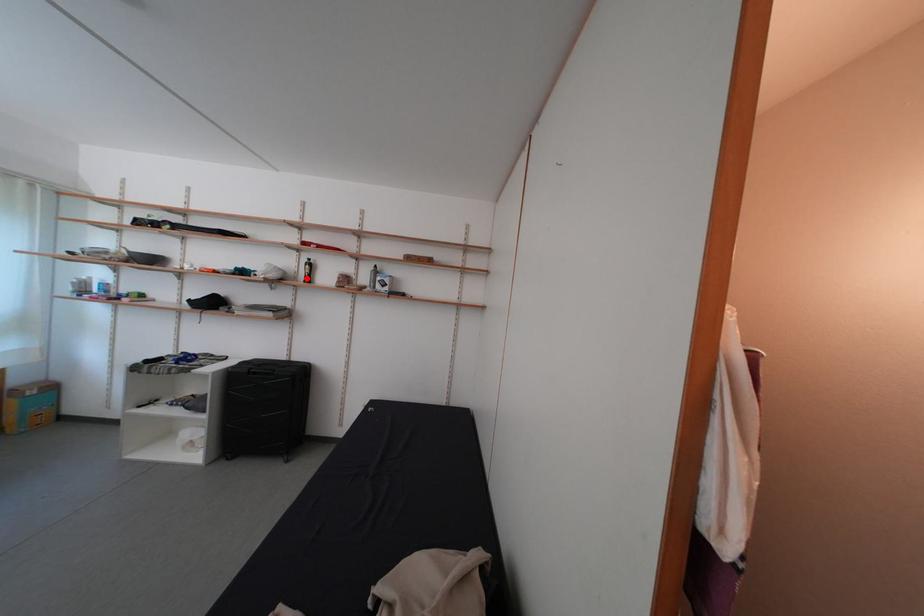
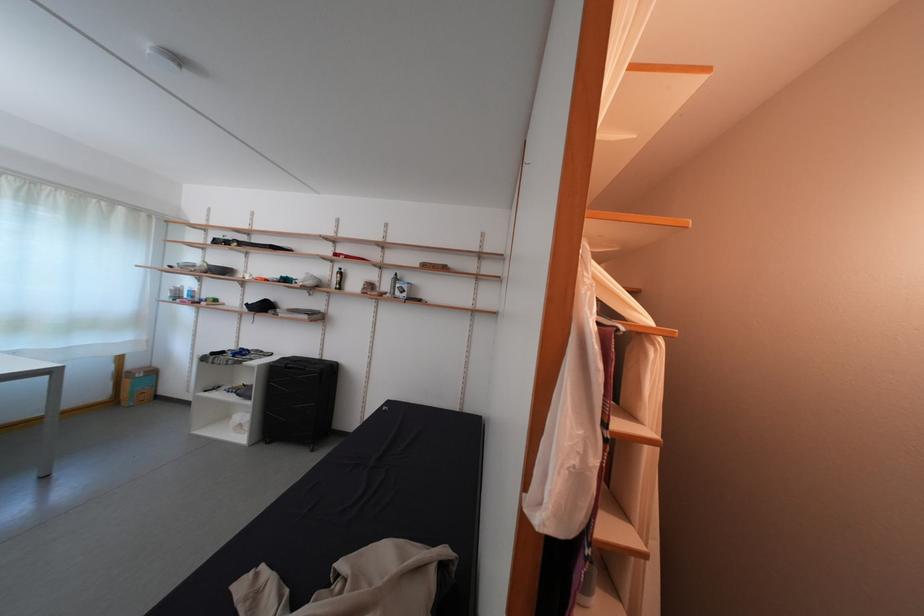
In the second image, find the point that corresponds to the highlighted location in the first image.

(339, 286)